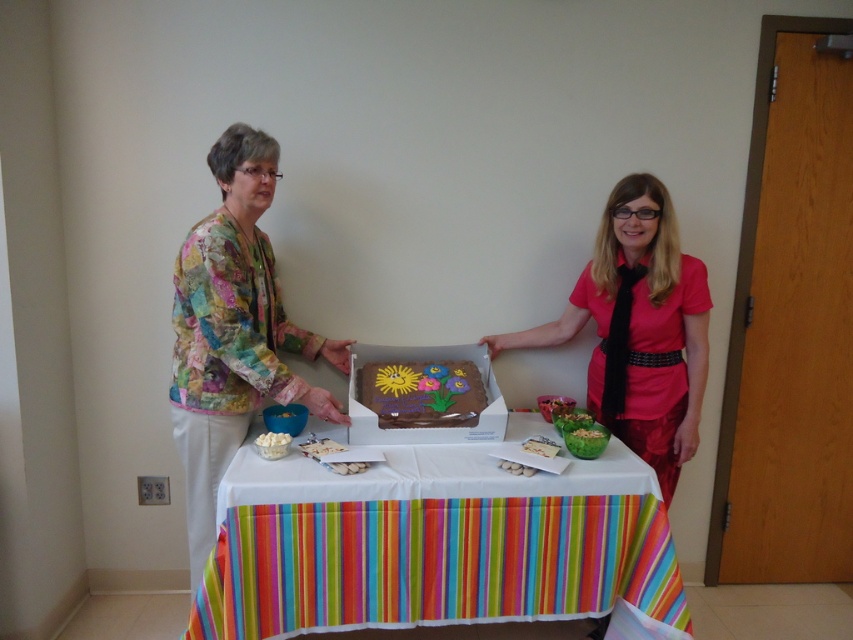
Who is taller, multicolored striped tablecloth at center or green plastic bowl at center?

multicolored striped tablecloth at center is taller.

Does multicolored striped tablecloth at center appear under green plastic bowl at center?

Correct, multicolored striped tablecloth at center is located below green plastic bowl at center.

Who is more forward, (428, 516) or (590, 445)?

Point (428, 516)

The image size is (853, 640). Find the location of `multicolored striped tablecloth at center`. multicolored striped tablecloth at center is located at coordinates (432, 545).

Who is positioned more to the left, white creamy popcorn at lower left or green leafy vegetable at center?

Positioned to the left is white creamy popcorn at lower left.

Describe the element at coordinates (271, 444) in the screenshot. I see `white creamy popcorn at lower left` at that location.

Does point (270, 435) come farther from viewer compared to point (579, 420)?

No, it is in front of (579, 420).

Find the location of a particular element. The image size is (853, 640). white creamy popcorn at lower left is located at coordinates (271, 444).

Which is below, multicolored striped tablecloth at center or chocolate cake at center?

Positioned lower is multicolored striped tablecloth at center.

Identify the location of multicolored striped tablecloth at center. The height and width of the screenshot is (640, 853). (432, 545).

Locate an element on the screen. This screenshot has width=853, height=640. multicolored striped tablecloth at center is located at coordinates (432, 545).